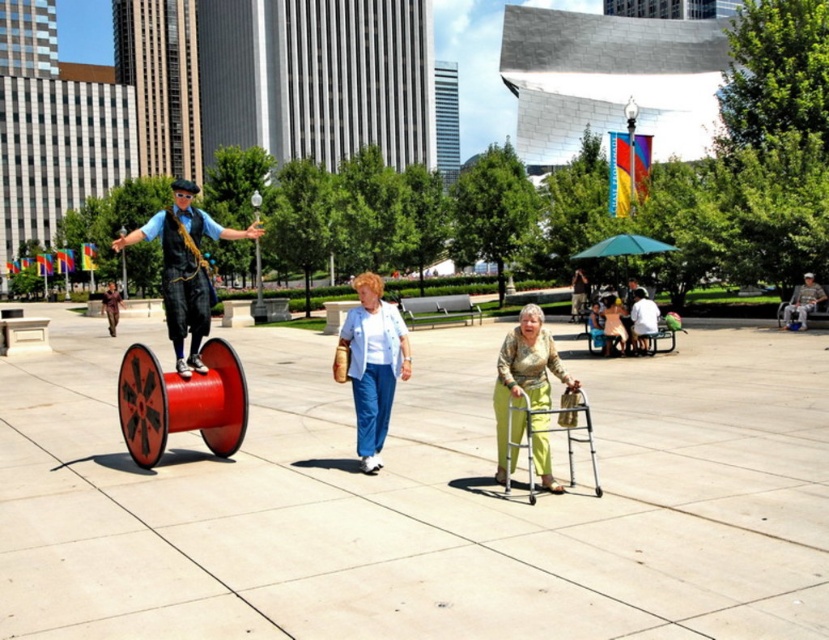
Does shiny red spool at center have a smaller size compared to metal walker at lower center?

No.

Does shiny red spool at center appear under metal walker at lower center?

No.

Identify the location of shiny red spool at center. The height and width of the screenshot is (640, 829). (185, 268).

Locate an element on the screen. This screenshot has height=640, width=829. shiny red spool at center is located at coordinates click(x=185, y=268).

The width and height of the screenshot is (829, 640). Find the location of `matte white blouse at center`. matte white blouse at center is located at coordinates (372, 364).

Does matte white blouse at center appear over metal walker at lower center?

Yes, matte white blouse at center is above metal walker at lower center.

The image size is (829, 640). Find the location of `matte white blouse at center`. matte white blouse at center is located at coordinates (372, 364).

Where is `matte white blouse at center`? matte white blouse at center is located at coordinates (372, 364).

Can you confirm if matte white blouse at center is shorter than green textured pants at center?

Yes, matte white blouse at center is shorter than green textured pants at center.

Who is lower down, matte white blouse at center or green textured pants at center?

matte white blouse at center is lower down.

Who is more forward, (390, 371) or (541, 317)?

Positioned in front is point (541, 317).

This screenshot has width=829, height=640. In order to click on matte white blouse at center in this screenshot , I will do `click(372, 364)`.